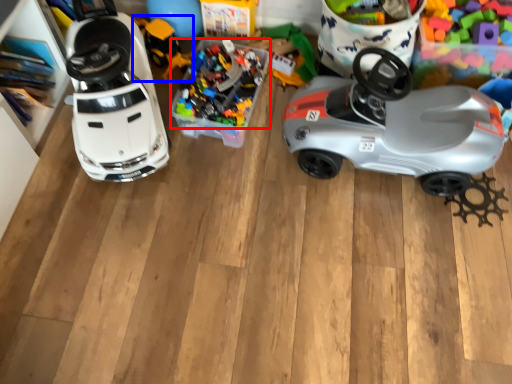
Question: Among these objects, which one is nearest to the camera, toy (highlighted by a red box) or toy (highlighted by a blue box)?

Choices:
 (A) toy
 (B) toy

Answer: (A)